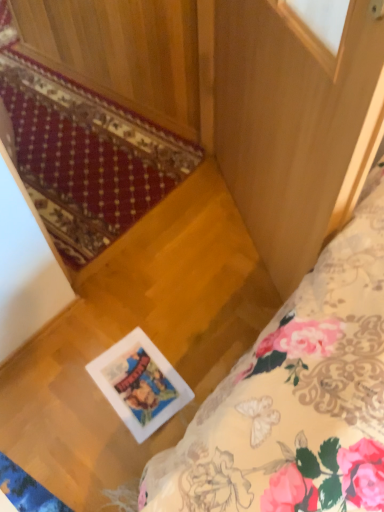
Question: From the image's perspective, would you say floral fabric bed at lower right is positioned over red carpet at lower left?

Choices:
 (A) yes
 (B) no

Answer: (B)

Question: Does floral fabric bed at lower right have a lesser width compared to red carpet at lower left?

Choices:
 (A) yes
 (B) no

Answer: (B)

Question: Is floral fabric bed at lower right positioned before red carpet at lower left?

Choices:
 (A) yes
 (B) no

Answer: (B)

Question: Is floral fabric bed at lower right behind red carpet at lower left?

Choices:
 (A) yes
 (B) no

Answer: (A)

Question: Would you say floral fabric bed at lower right is a long distance from red carpet at lower left?

Choices:
 (A) no
 (B) yes

Answer: (B)

Question: Does floral fabric bed at lower right have a smaller size compared to red carpet at lower left?

Choices:
 (A) no
 (B) yes

Answer: (B)

Question: Is floral fabric bed at lower right to the left of white glossy picture frame at center from the viewer's perspective?

Choices:
 (A) yes
 (B) no

Answer: (B)

Question: Are floral fabric bed at lower right and white glossy picture frame at center located far from each other?

Choices:
 (A) yes
 (B) no

Answer: (B)

Question: Is floral fabric bed at lower right to the right of white glossy picture frame at center from the viewer's perspective?

Choices:
 (A) yes
 (B) no

Answer: (A)

Question: Can you confirm if floral fabric bed at lower right is taller than white glossy picture frame at center?

Choices:
 (A) no
 (B) yes

Answer: (B)

Question: Does floral fabric bed at lower right have a larger size compared to white glossy picture frame at center?

Choices:
 (A) yes
 (B) no

Answer: (A)

Question: From the image's perspective, is floral fabric bed at lower right under white glossy picture frame at center?

Choices:
 (A) no
 (B) yes

Answer: (A)

Question: Considering the relative sizes of white glossy picture frame at center and floral fabric bed at lower right in the image provided, is white glossy picture frame at center taller than floral fabric bed at lower right?

Choices:
 (A) no
 (B) yes

Answer: (A)